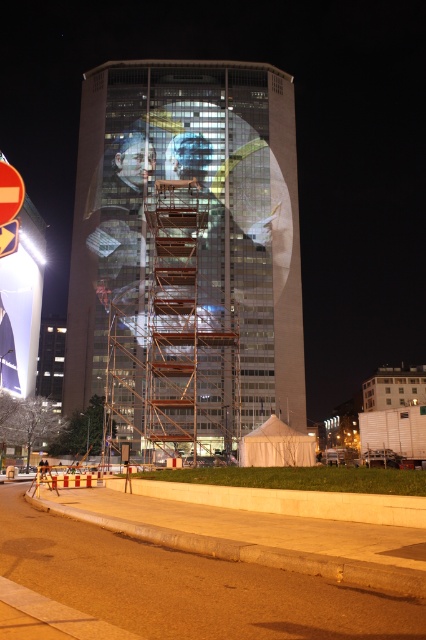
Question: Which object appears farthest from the camera in this image?

Choices:
 (A) matte glass tower at center
 (B) metal scaffolding at center

Answer: (A)

Question: Does metal scaffolding at center have a smaller size compared to rustic metal scaffolding at center?

Choices:
 (A) no
 (B) yes

Answer: (B)

Question: Is matte glass tower at center above metal scaffolding at center?

Choices:
 (A) no
 (B) yes

Answer: (B)

Question: Which object is the closest to the metal scaffolding at center?

Choices:
 (A) matte glass tower at center
 (B) rustic metal scaffolding at center

Answer: (B)

Question: Can you confirm if matte glass tower at center is positioned below metal scaffolding at center?

Choices:
 (A) yes
 (B) no

Answer: (B)

Question: Based on their relative distances, which object is nearer to the matte glass tower at center?

Choices:
 (A) rustic metal scaffolding at center
 (B) metal scaffolding at center

Answer: (A)